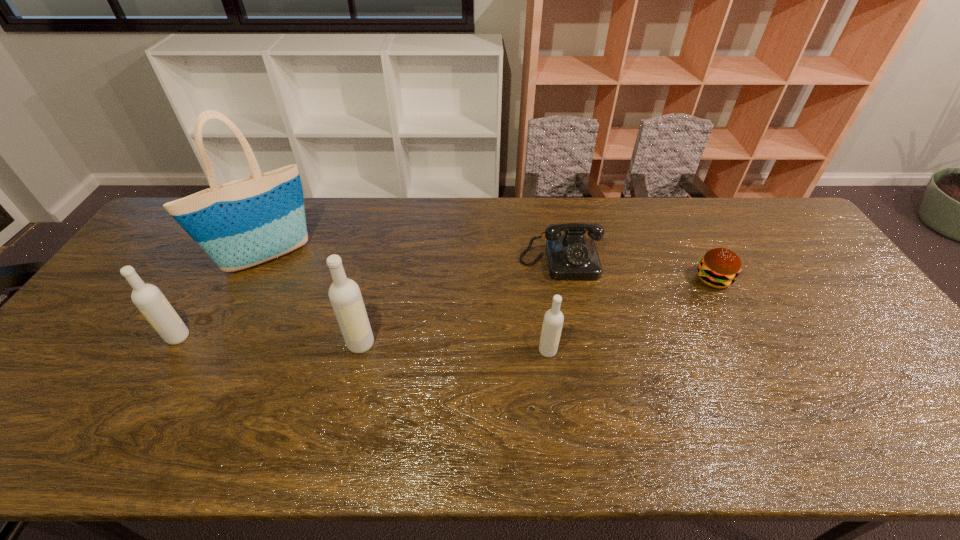
Where is `vacant space located 0.360m on the right of the second tallest vodka`? The width and height of the screenshot is (960, 540). vacant space located 0.360m on the right of the second tallest vodka is located at coordinates (327, 337).

Identify the location of blank space located on the back of the fourth object from right to left. (368, 313).

I want to click on free spot located on the left of the shortest vodka, so click(511, 351).

Where is `free space located on the front of the rightmost object`? The image size is (960, 540). free space located on the front of the rightmost object is located at coordinates (753, 354).

Find the location of a particular element. The image size is (960, 540). blank area located 0.150m on the front of the tote bag is located at coordinates (235, 321).

Identify the location of free space located on the dial of the second shortest object. This screenshot has width=960, height=540. (581, 371).

The width and height of the screenshot is (960, 540). I want to click on object located at the far edge, so click(x=249, y=221).

What are the coordinates of `free space at the far edge of the desktop` in the screenshot? It's located at (391, 206).

Identify the location of vacant space at the near edge. (736, 400).

Locate an element on the screen. This screenshot has width=960, height=540. vacant space at the left edge is located at coordinates (91, 370).